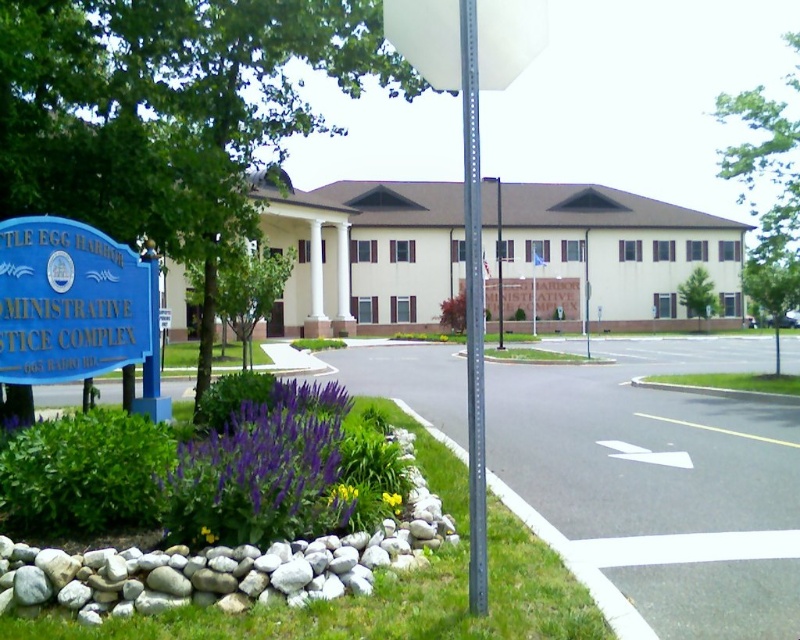
Does purple matte flower at lower center come behind yellow matte flower at lower center?

No, it is not.

Between purple matte flower at lower center and yellow matte flower at lower center, which one is positioned lower?

Positioned lower is yellow matte flower at lower center.

Which is behind, point (284, 492) or point (388, 502)?

Point (388, 502)

The width and height of the screenshot is (800, 640). Identify the location of purple matte flower at lower center. (264, 468).

In the scene shown: Between white plastic sign at upper center and yellow matte flower at lower center, which one is positioned higher?

white plastic sign at upper center

Measure the distance from white plastic sign at upper center to yellow matte flower at lower center.

The distance of white plastic sign at upper center from yellow matte flower at lower center is 30.17 feet.

Is point (165, 323) positioned after point (397, 504)?

Yes.

Identify the location of white plastic sign at upper center. (164, 317).

Which of these two, metallic gray pole at center or white plastic sign at upper center, stands shorter?

white plastic sign at upper center

At what (x,y) coordinates should I click in order to perform the action: click on metallic gray pole at center. Please return your answer as a coordinate pair (x, y). Looking at the image, I should click on (474, 308).

This screenshot has width=800, height=640. Identify the location of metallic gray pole at center. (474, 308).